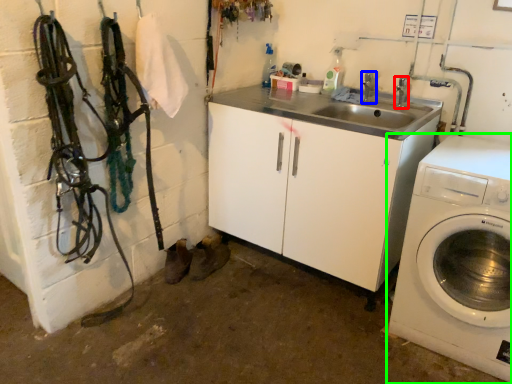
Question: Based on their relative distances, which object is farther from faucet (highlighted by a red box)? Choose from faucet (highlighted by a blue box) and washing machine (highlighted by a green box).

Choices:
 (A) faucet
 (B) washing machine

Answer: (B)